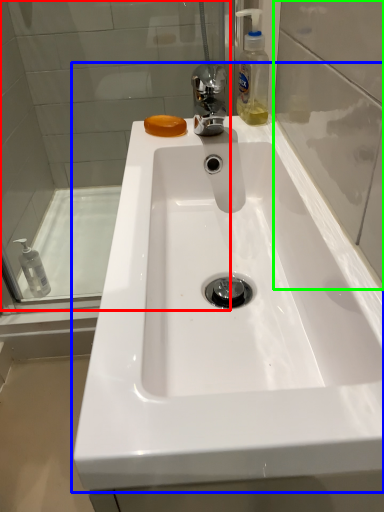
Question: Based on their relative distances, which object is nearer to shower door (highlighted by a red box)? Choose from sink (highlighted by a blue box) and glass door (highlighted by a green box).

Choices:
 (A) sink
 (B) glass door

Answer: (A)